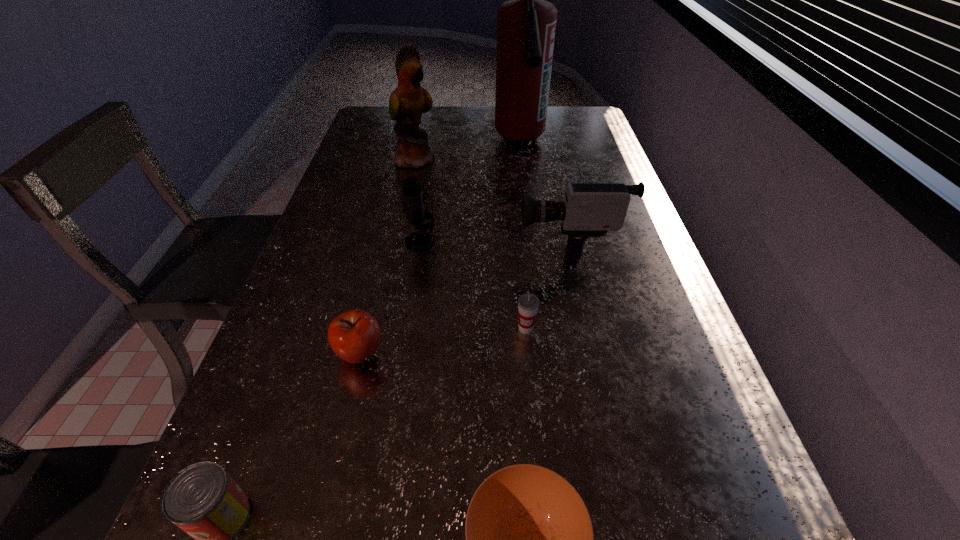
Where is `blank space at the far left corner`? The image size is (960, 540). blank space at the far left corner is located at coordinates (368, 135).

I want to click on blank area at the far right corner, so click(587, 111).

Where is `free spot between the second tallest object and the cup`? Image resolution: width=960 pixels, height=540 pixels. free spot between the second tallest object and the cup is located at coordinates (471, 244).

The width and height of the screenshot is (960, 540). I want to click on empty space between the apple and the camcorder, so click(x=465, y=298).

This screenshot has width=960, height=540. Identify the location of vacant area between the fire extinguisher and the apple. (441, 248).

Identify the location of free space between the parrot and the apple. The height and width of the screenshot is (540, 960). (388, 256).

Locate an element on the screen. object that is the seventh closest to the fire extinguisher is located at coordinates (203, 500).

You are a GUI agent. You are given a task and a screenshot of the screen. Output one action in this format:
    pyautogui.click(x=<x>, y=<y>)
    Task: Click on the object that is the third nearest to the fire extinguisher
    The image size is (960, 540).
    Given the screenshot: What is the action you would take?
    pyautogui.click(x=413, y=196)

Image resolution: width=960 pixels, height=540 pixels. What are the coordinates of `free space in the image that satisfies the following two spatial constraints: 1. on the recording direction of the camcorder; 2. on the front side of the apple` in the screenshot? It's located at (593, 354).

The width and height of the screenshot is (960, 540). Find the location of `vacant space that satisfies the following two spatial constraints: 1. on the front-facing side of the microphone; 2. on the left side of the parrot`. vacant space that satisfies the following two spatial constraints: 1. on the front-facing side of the microphone; 2. on the left side of the parrot is located at coordinates (399, 241).